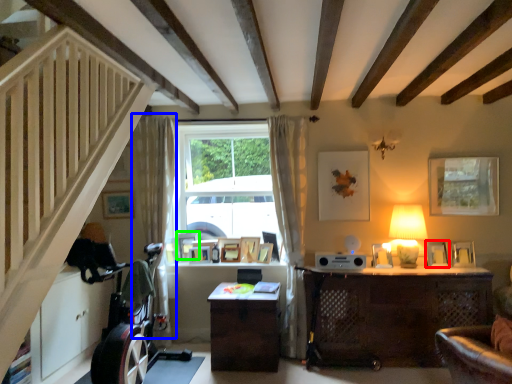
Question: Based on their relative distances, which object is nearer to picture frame (highlighted by a red box)? Choose from curtain (highlighted by a blue box) and picture frame (highlighted by a green box).

Choices:
 (A) curtain
 (B) picture frame

Answer: (B)